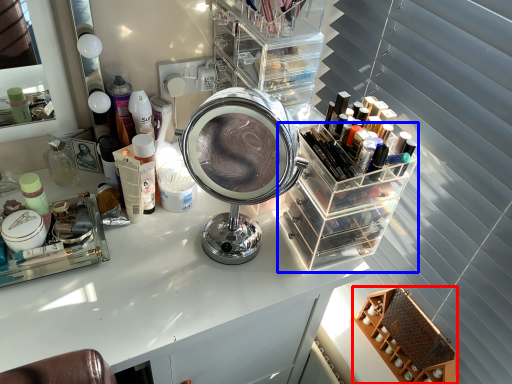
Question: Which of the following is the closest to the observer, shelf (highlighted by a red box) or glass box (highlighted by a blue box)?

Choices:
 (A) shelf
 (B) glass box

Answer: (B)